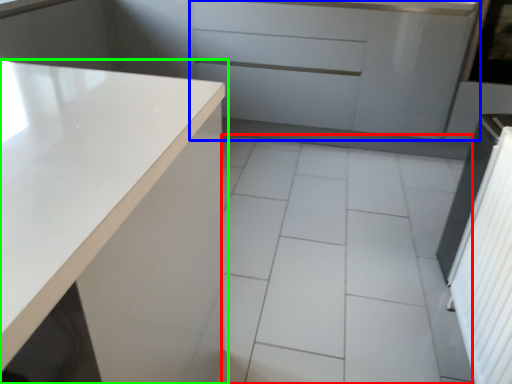
Question: Considering the real-world distances, which object is closest to ceramic tile (highlighted by a red box)? cabinetry (highlighted by a blue box) or countertop (highlighted by a green box).

Choices:
 (A) cabinetry
 (B) countertop

Answer: (B)